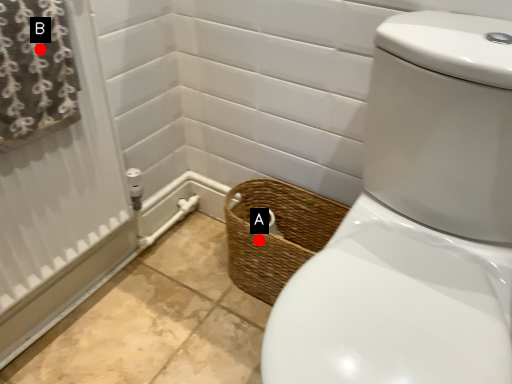
Question: Two points are circled on the image, labeled by A and B beside each circle. Which point is farther from the camera taking this photo?

Choices:
 (A) A is further
 (B) B is further

Answer: (A)